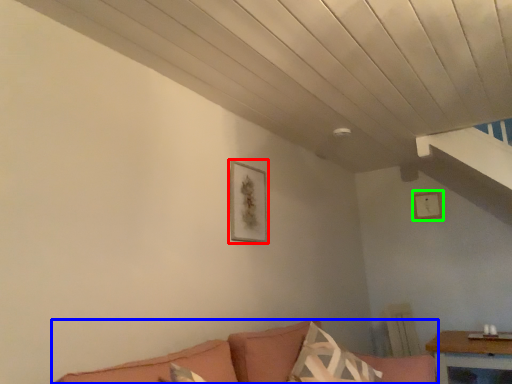
Question: Which object is positioned farthest from picture frame (highlighted by a red box)? Select from studio couch (highlighted by a blue box) and picture frame (highlighted by a green box).

Choices:
 (A) studio couch
 (B) picture frame

Answer: (B)